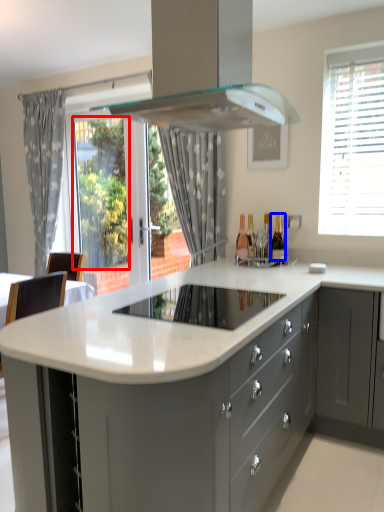
Question: Which of the following is the farthest to the observer, window screen (highlighted by a red box) or wine bottle (highlighted by a blue box)?

Choices:
 (A) window screen
 (B) wine bottle

Answer: (A)